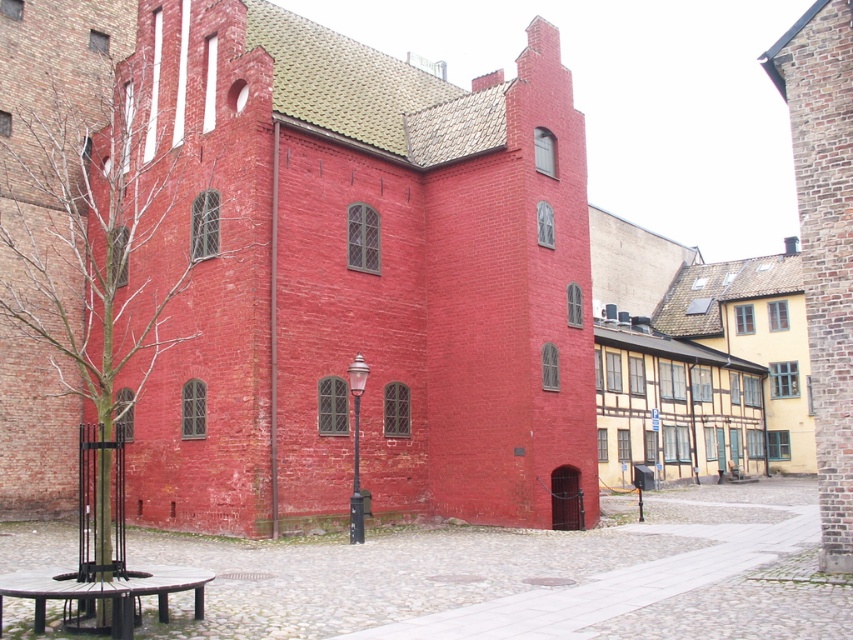
Between brick textured church at center and black polished stone picnic table at lower left, which one is positioned lower?

black polished stone picnic table at lower left is below.

Is brick textured church at center taller than black polished stone picnic table at lower left?

Yes.

Is point (587, 356) farther from viewer compared to point (210, 579)?

Yes, point (587, 356) is farther from viewer.

Identify the location of brick textured church at center. (367, 282).